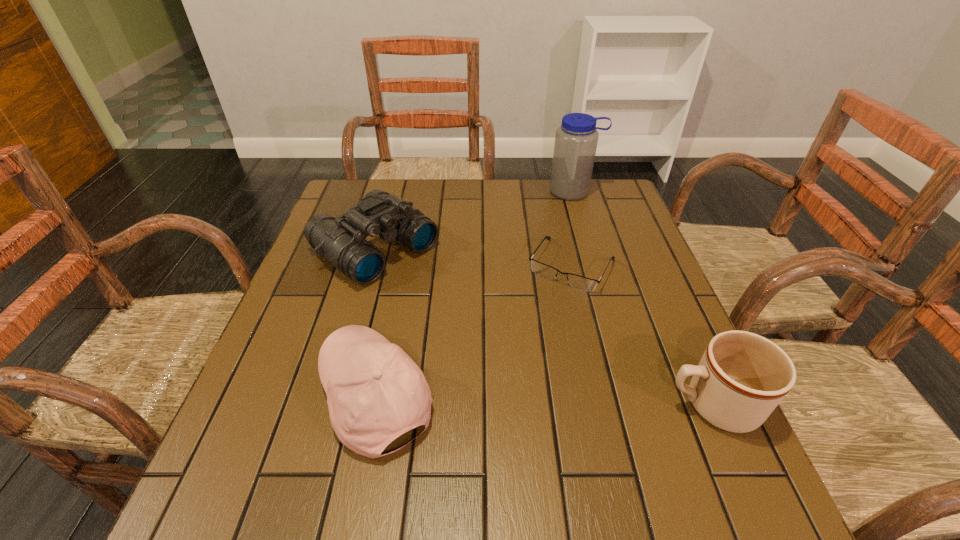
Locate an element on the screen. baseball cap is located at coordinates (375, 392).

The image size is (960, 540). I want to click on mug, so click(741, 378).

At what (x,y) coordinates should I click in order to perform the action: click on binoculars. Please return your answer as a coordinate pair (x, y). Looking at the image, I should click on (342, 241).

At what (x,y) coordinates should I click in order to perform the action: click on the farthest object. Please return your answer as a coordinate pair (x, y). Looking at the image, I should click on (576, 139).

Locate an element on the screen. This screenshot has height=540, width=960. water bottle is located at coordinates click(576, 139).

Find the location of a particular element. The width and height of the screenshot is (960, 540). the shortest object is located at coordinates (578, 282).

You are a GUI agent. You are given a task and a screenshot of the screen. Output one action in this format:
    pyautogui.click(x=<x>, y=<y>)
    Task: Click on the vacant space located on the front-facing side of the baseball cap
    The height and width of the screenshot is (540, 960).
    Given the screenshot: What is the action you would take?
    pyautogui.click(x=247, y=396)

Locate an element on the screen. The width and height of the screenshot is (960, 540). free space located 0.320m on the side of the mug with the handle is located at coordinates (493, 404).

Locate an element on the screen. The height and width of the screenshot is (540, 960). free location located 0.400m on the side of the mug with the handle is located at coordinates (450, 404).

Find the location of a particular element. free space located on the side of the mug with the handle is located at coordinates (584, 404).